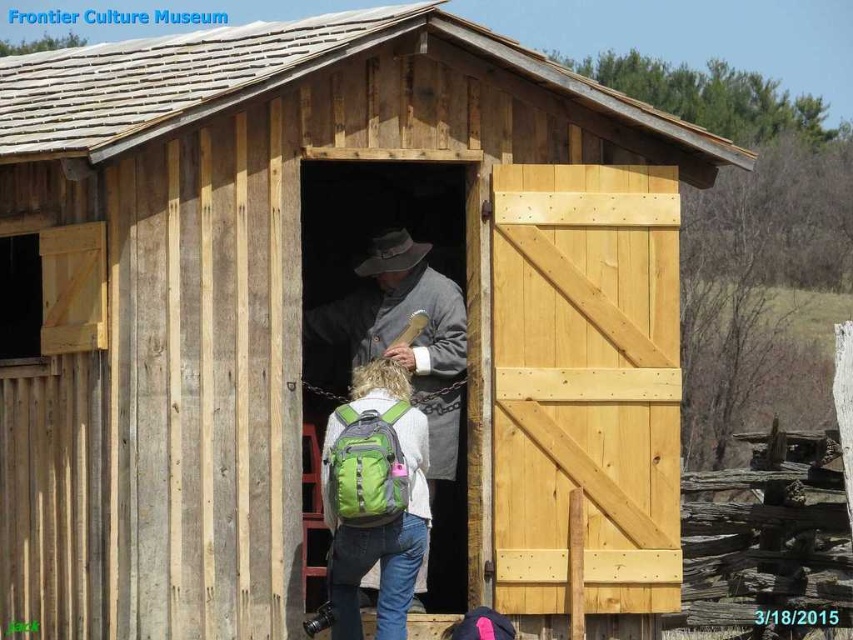
You are a visitor at the Frontier Culture Museum and notice two items inside the rustic wooden structure. The gray woolen coat at center and the green fabric backpack at center. Which item is taller?

The gray woolen coat at center is taller than the green fabric backpack at center.

Looking at this image, you are standing at the entrance of the rustic wooden structure at the Frontier Culture Museum. You notice two points marked on the floor inside the building. The first point is at coordinate point (x=664, y=586) and the second point is at coordinate point (x=450, y=445). If you want to walk towards the point that is closer to the entrance, which coordinate should you aim for?

Point (x=450, y=445) is closer to the entrance because it is behind point (x=664, y=586), meaning it is nearer to the entrance.